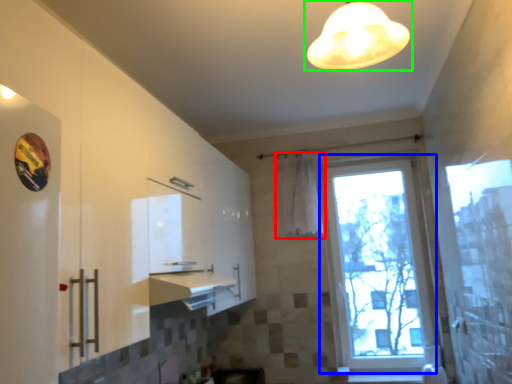
Question: Considering the real-world distances, which object is closest to curtain (highlighted by a red box)? window (highlighted by a blue box) or lamp (highlighted by a green box).

Choices:
 (A) window
 (B) lamp

Answer: (A)